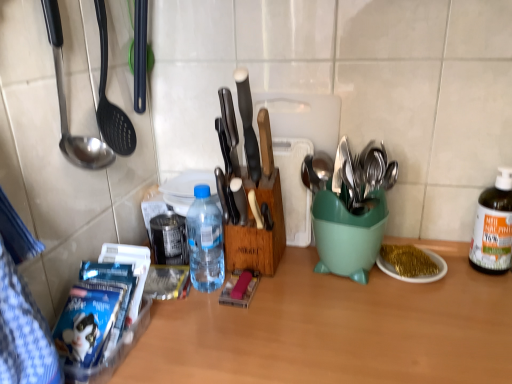
I want to click on vacant area that lies between gold glitter plate at right and green plastic bottle at right, the first bottle in the right-to-left sequence, so click(463, 273).